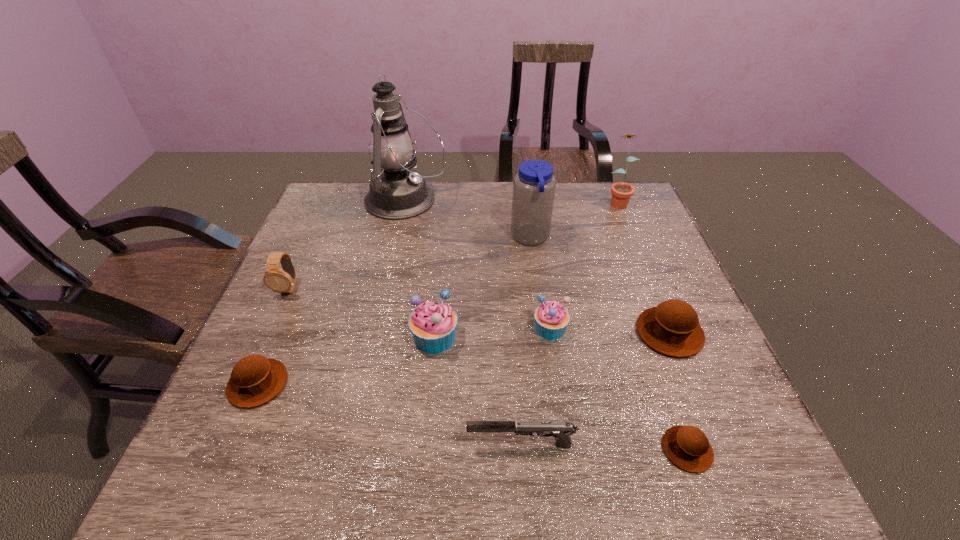
Identify the location of object at the near right corner. 687,447.

Locate an element on the screen. vacant space at the far edge of the desktop is located at coordinates (484, 222).

What are the coordinates of `free space at the near edge of the desktop` in the screenshot? It's located at (310, 481).

Find the location of `vacant region at the left edge of the desktop`. vacant region at the left edge of the desktop is located at coordinates (310, 321).

Identify the location of free space at the right edge of the desktop. (655, 272).

Identify the location of vacant area at the far left corner. (327, 186).

Find the location of a particular element. This screenshot has width=960, height=540. vacant space at the near left corner is located at coordinates (271, 447).

Locate an element on the screen. The image size is (960, 540). free space at the far right corner of the desktop is located at coordinates (630, 210).

Image resolution: width=960 pixels, height=540 pixels. In the image, there is a desktop. Find the location of `free space at the near right corner`. free space at the near right corner is located at coordinates (755, 464).

What are the coordinates of `vacant space that is in between the right blue muffin and the biggest brown muffin` in the screenshot? It's located at tap(610, 330).